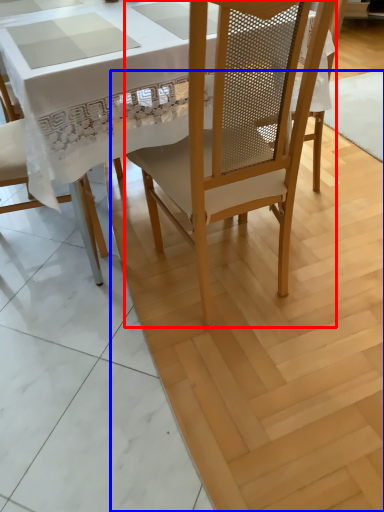
Question: Which point is further to the camera, chair (highlighted by a red box) or plywood (highlighted by a blue box)?

Choices:
 (A) chair
 (B) plywood

Answer: (B)